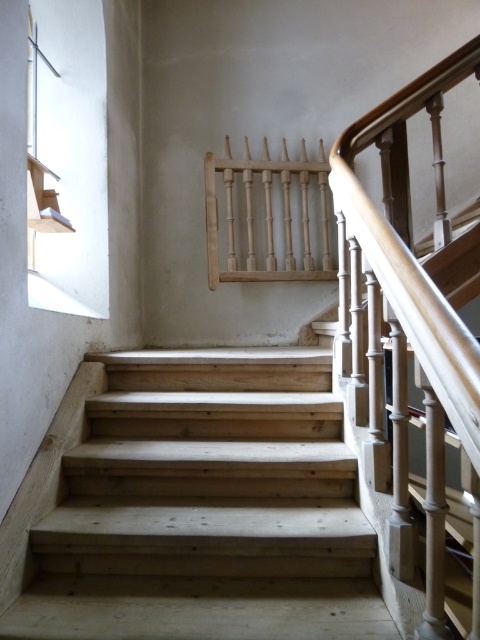
Is natural wood stairs at center bigger than light brown polished wood handrail at upper right?

No, natural wood stairs at center is not bigger than light brown polished wood handrail at upper right.

Which of these two, natural wood stairs at center or light brown polished wood handrail at upper right, stands taller?

light brown polished wood handrail at upper right

Identify the location of natural wood stairs at center. This screenshot has width=480, height=640. (205, 508).